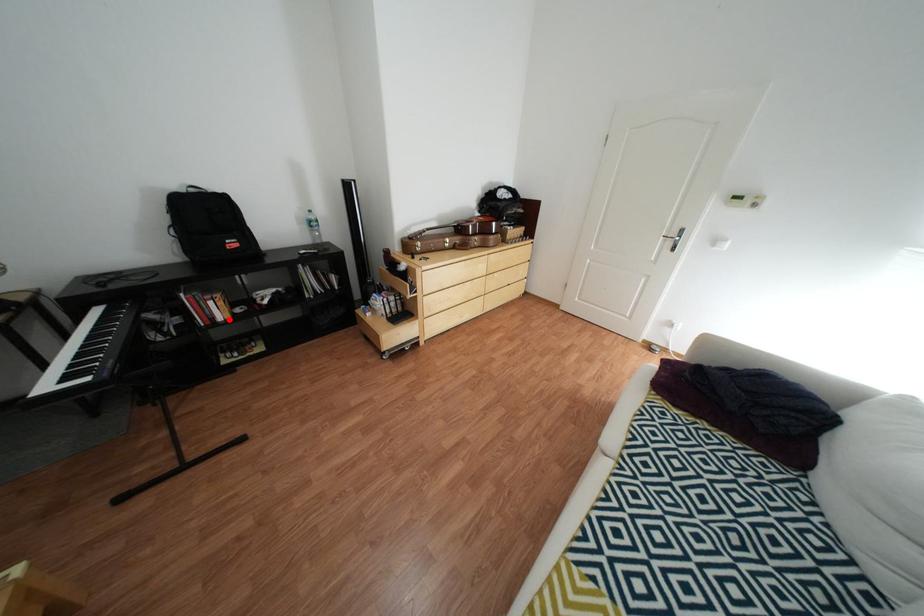
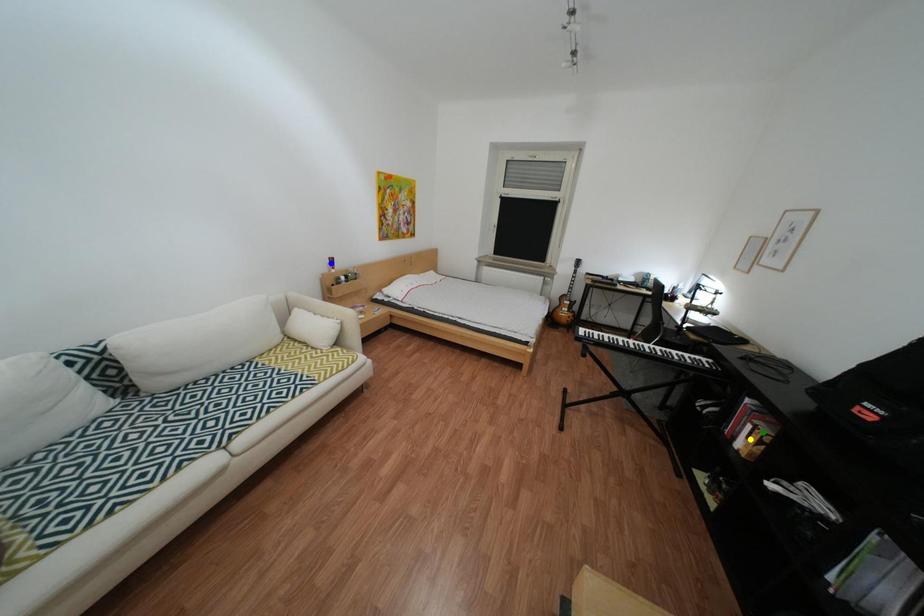
Question: I am providing you with two images of the same scene from different viewpoints. A red point is marked on the first image. You are given multiple points on the second image. In image 2, which mark is for the same physical point as the one in image 1?

Choices:
 (A) green point
 (B) yellow point
 (C) blue point

Answer: (B)